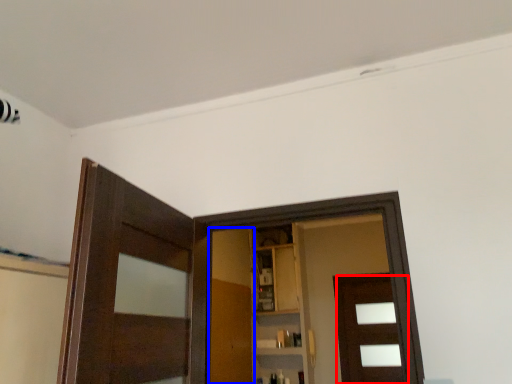
Question: Which point is further to the camera, door (highlighted by a red box) or barn door (highlighted by a blue box)?

Choices:
 (A) door
 (B) barn door

Answer: (A)